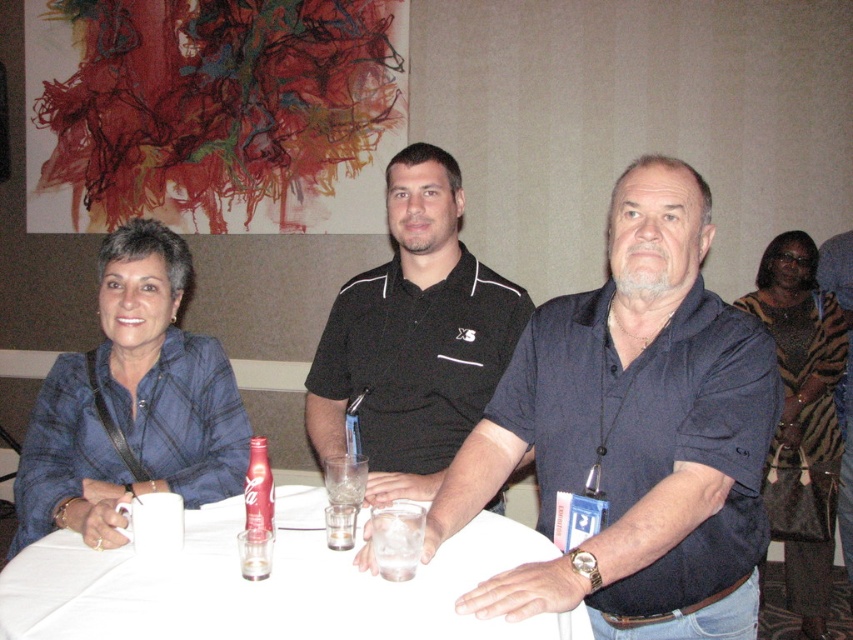
You are planning to place a rectangular gift box on the table. The gift box is as wide as the tiger print scarf at center. Will the white plastic table at center have enough space to accommodate the gift box without overhanging the edges?

The white plastic table at center is wider than the tiger print scarf at center, so the gift box, which is as wide as the tiger print scarf at center, will fit on the white plastic table at center without overhanging the edges.

You are standing in front of the table where three people are seated. There are two points marked on the table surface. The first point is at coordinate (708,547) and the second point is at (201,417). Which of these two points is closer to you?

Point (708,547) is closer to the viewer than point (201,417).